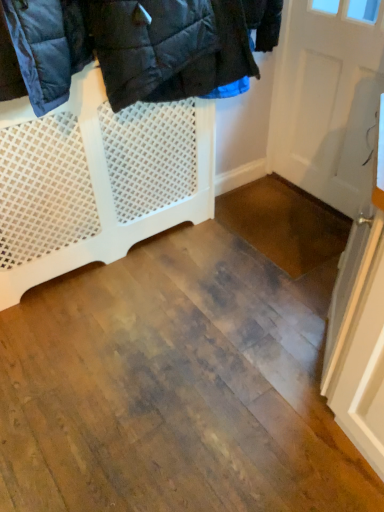
Question: Can you confirm if white mesh gate at upper left is thinner than white matte door at upper right?

Choices:
 (A) yes
 (B) no

Answer: (B)

Question: Can you confirm if white mesh gate at upper left is smaller than white matte door at upper right?

Choices:
 (A) yes
 (B) no

Answer: (B)

Question: From a real-world perspective, is white mesh gate at upper left located higher than white matte door at upper right?

Choices:
 (A) no
 (B) yes

Answer: (A)

Question: Does white mesh gate at upper left lie in front of white matte door at upper right?

Choices:
 (A) no
 (B) yes

Answer: (B)

Question: Does white mesh gate at upper left appear on the right side of white matte door at upper right?

Choices:
 (A) yes
 (B) no

Answer: (B)

Question: Is white mesh gate at upper left located outside white matte door at upper right?

Choices:
 (A) yes
 (B) no

Answer: (A)

Question: Considering the relative sizes of white matte door at upper right and white mesh gate at upper left in the image provided, is white matte door at upper right wider than white mesh gate at upper left?

Choices:
 (A) no
 (B) yes

Answer: (A)

Question: From a real-world perspective, is white matte door at upper right positioned under white mesh gate at upper left based on gravity?

Choices:
 (A) yes
 (B) no

Answer: (B)

Question: From the image's perspective, is white matte door at upper right beneath white mesh gate at upper left?

Choices:
 (A) yes
 (B) no

Answer: (B)

Question: Is white matte door at upper right positioned with its back to white mesh gate at upper left?

Choices:
 (A) yes
 (B) no

Answer: (B)

Question: Considering the relative sizes of white matte door at upper right and white mesh gate at upper left in the image provided, is white matte door at upper right thinner than white mesh gate at upper left?

Choices:
 (A) yes
 (B) no

Answer: (A)

Question: Is white matte door at upper right behind white mesh gate at upper left?

Choices:
 (A) no
 (B) yes

Answer: (B)

Question: Is white mesh gate at upper left taller or shorter than white matte door at upper right?

Choices:
 (A) short
 (B) tall

Answer: (A)